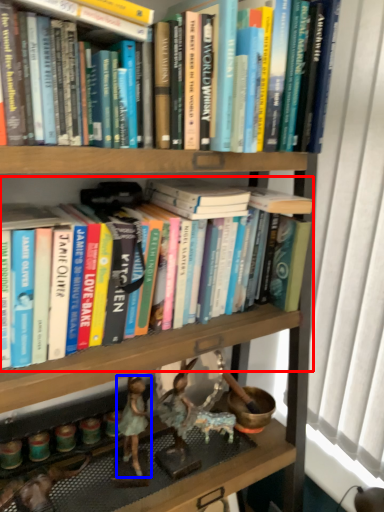
Question: Which of the following is the farthest to the observer, book (highlighted by a red box) or person (highlighted by a blue box)?

Choices:
 (A) book
 (B) person

Answer: (B)